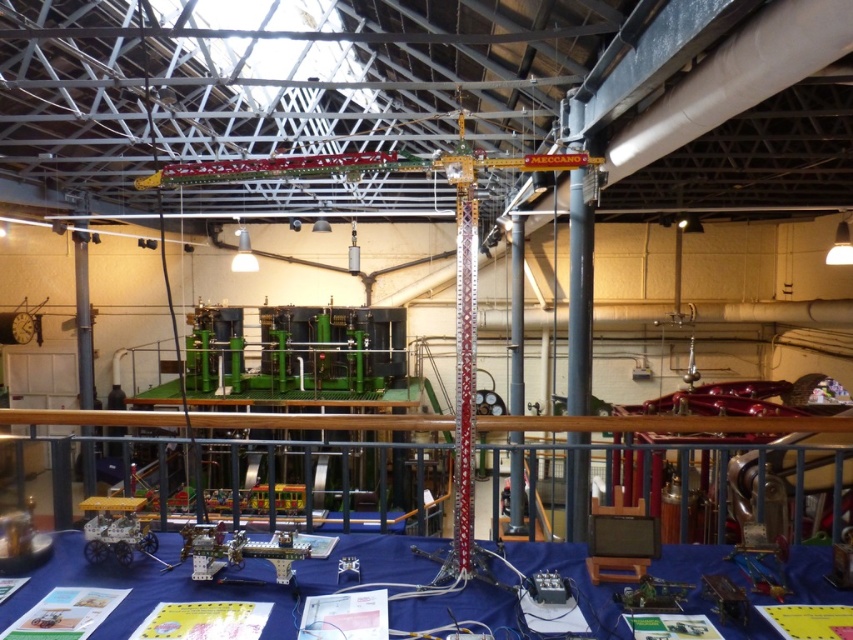
Between metallic red crane at center and metallic gray pole at center, which one appears on the right side from the viewer's perspective?

metallic gray pole at center is more to the right.

Does metallic red crane at center have a smaller size compared to metallic gray pole at center?

No, metallic red crane at center is not smaller than metallic gray pole at center.

Who is more forward, (459,456) or (512,440)?

Point (459,456) is more forward.

Identify the location of metallic red crane at center. Image resolution: width=853 pixels, height=640 pixels. (474, 307).

Is blue fabric table at lower center to the left of metallic red crane at center from the viewer's perspective?

Correct, you'll find blue fabric table at lower center to the left of metallic red crane at center.

Between blue fabric table at lower center and metallic red crane at center, which one has less height?

blue fabric table at lower center is shorter.

Identify the location of blue fabric table at lower center. (218, 582).

Where is `blue fabric table at lower center`? The width and height of the screenshot is (853, 640). blue fabric table at lower center is located at coordinates click(x=218, y=582).

Who is lower down, blue fabric table at lower center or metallic gray pole at center?

blue fabric table at lower center is lower down.

Does blue fabric table at lower center appear over metallic gray pole at center?

No, blue fabric table at lower center is not above metallic gray pole at center.

Which is in front, point (724, 563) or point (514, 365)?

Point (724, 563) is more forward.

In order to click on blue fabric table at lower center in this screenshot , I will do `click(218, 582)`.